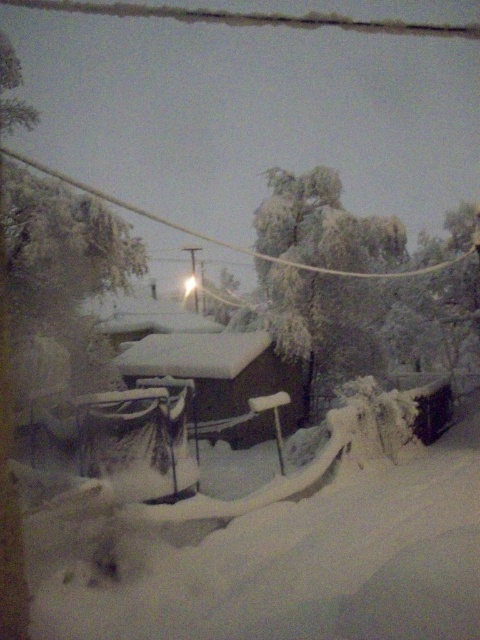
Is frosted green tree at center taller than white snow-covered hut at center?

Yes, frosted green tree at center is taller than white snow-covered hut at center.

Is frosted green tree at center in front of white snow-covered hut at center?

That is False.

Does point (254, 228) come behind point (269, 422)?

Yes.

Where is `frosted green tree at center`? The width and height of the screenshot is (480, 640). frosted green tree at center is located at coordinates (324, 275).